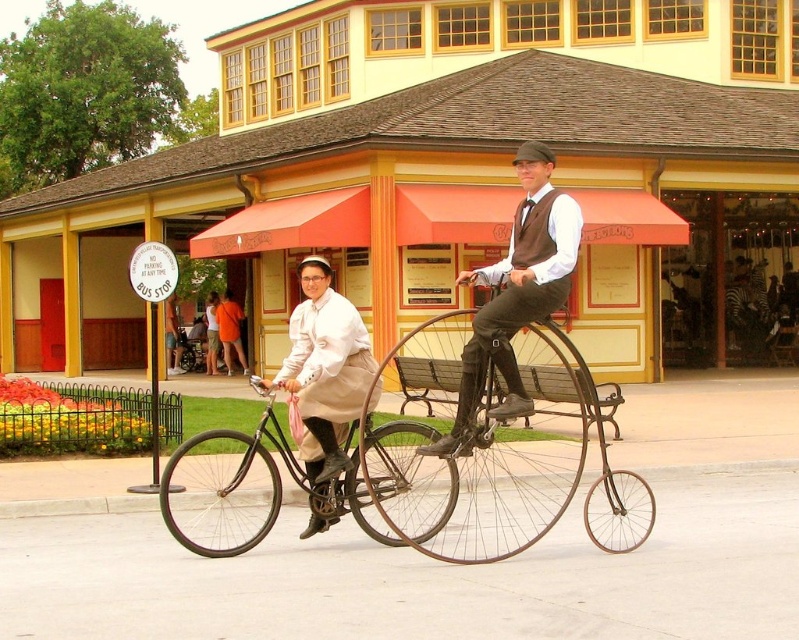
You are a photographer at the park and want to capture both the brown leather vest at center and the matte white dress at center in a single photo. Considering their heights, which one should you position closer to the camera to ensure both are fully visible?

Since the brown leather vest at center is much taller than the matte white dress at center, you should position the brown leather vest at center closer to the camera to ensure both are fully visible in the photo.

You are standing at the point with coordinates point (324, 305) and want to move towards the point with coordinates point (531, 404). Are you facing the right direction to reach your destination?

Yes, because point (531, 404) is in front of point (324, 305), so moving forward from your current position will lead you directly to the destination.

You are a park visitor who wants to take a photo of the black matte bicycle at center and the brown leather vest at center. Can you fit both in your camera frame if your camera has a maximum field of view of 3 feet?

The black matte bicycle at center and the brown leather vest at center are 3.68 feet apart, which exceeds the camera frame of 3 feet. Therefore, you cannot fit both in the frame.